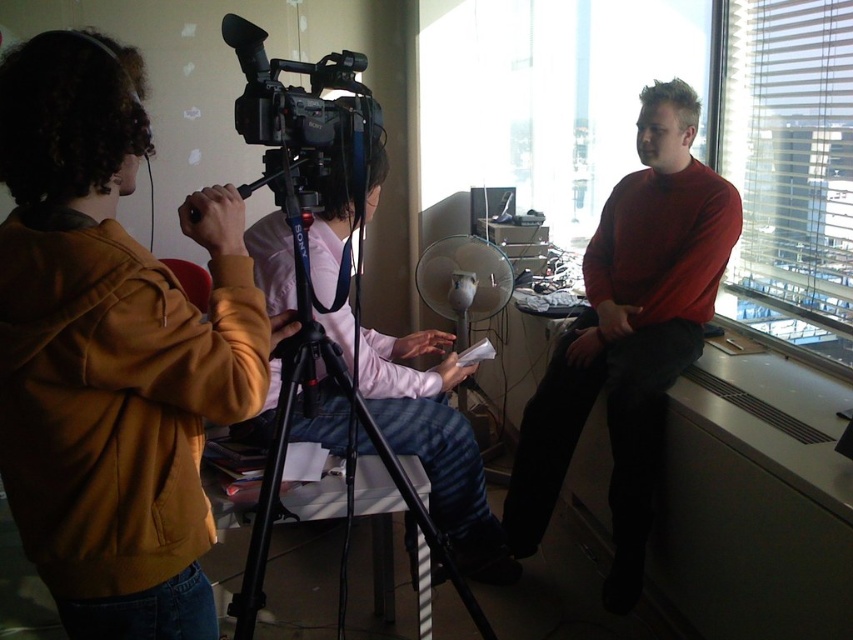
You are standing at point A located at coordinates point(714, 161) and want to move to point B at point(471, 472). Is there a clear path between these two points?

The path between point(714, 161) and point(471, 472) is clear since there are no obstacles mentioned in the scene description.

You are setting up a camera on the black plastic tripod at center to capture the scene through the transparent glass window at right. Which object should be placed higher to ensure the camera can frame the window properly?

The black plastic tripod at center needs to be placed higher because the transparent glass window at right is taller than the black plastic tripod at center, allowing the camera to capture the entire height of the window.